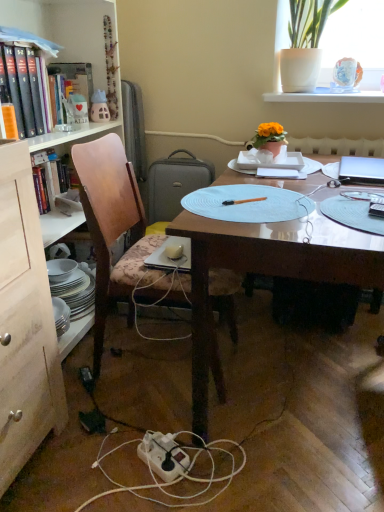
Question: From the image's perspective, would you say matte plastic cup at upper left, which is the 1th book from back to front, is shown under clear plastic pen at center?

Choices:
 (A) no
 (B) yes

Answer: (A)

Question: Considering the relative positions of matte plastic cup at upper left, which is the 1th book from back to front, and clear plastic pen at center in the image provided, is matte plastic cup at upper left, which is the 1th book from back to front, to the left of clear plastic pen at center from the viewer's perspective?

Choices:
 (A) no
 (B) yes

Answer: (B)

Question: Could you tell me if matte plastic cup at upper left, which is the 1th book from back to front, is facing clear plastic pen at center?

Choices:
 (A) yes
 (B) no

Answer: (B)

Question: Is matte plastic cup at upper left, which is counted as the second book, starting from the front, outside clear plastic pen at center?

Choices:
 (A) yes
 (B) no

Answer: (A)

Question: From a real-world perspective, does matte plastic cup at upper left, which is the 1th book from back to front, stand above clear plastic pen at center?

Choices:
 (A) no
 (B) yes

Answer: (B)

Question: Is matte plastic cup at upper left, which is counted as the second book, starting from the front, looking in the opposite direction of clear plastic pen at center?

Choices:
 (A) no
 (B) yes

Answer: (A)

Question: Considering the relative positions of wooden bookcase at left and wooden chair at left in the image provided, is wooden bookcase at left to the left of wooden chair at left from the viewer's perspective?

Choices:
 (A) yes
 (B) no

Answer: (A)

Question: Is wooden bookcase at left to the right of wooden chair at left from the viewer's perspective?

Choices:
 (A) yes
 (B) no

Answer: (B)

Question: Does wooden bookcase at left come behind wooden chair at left?

Choices:
 (A) no
 (B) yes

Answer: (A)

Question: Is wooden bookcase at left touching wooden chair at left?

Choices:
 (A) no
 (B) yes

Answer: (A)

Question: Does wooden bookcase at left have a greater height compared to wooden chair at left?

Choices:
 (A) no
 (B) yes

Answer: (B)

Question: Is wooden bookcase at left looking in the opposite direction of wooden chair at left?

Choices:
 (A) yes
 (B) no

Answer: (A)

Question: Can you confirm if light blue paper plate at center is smaller than silver metallic laptop at upper right?

Choices:
 (A) yes
 (B) no

Answer: (A)